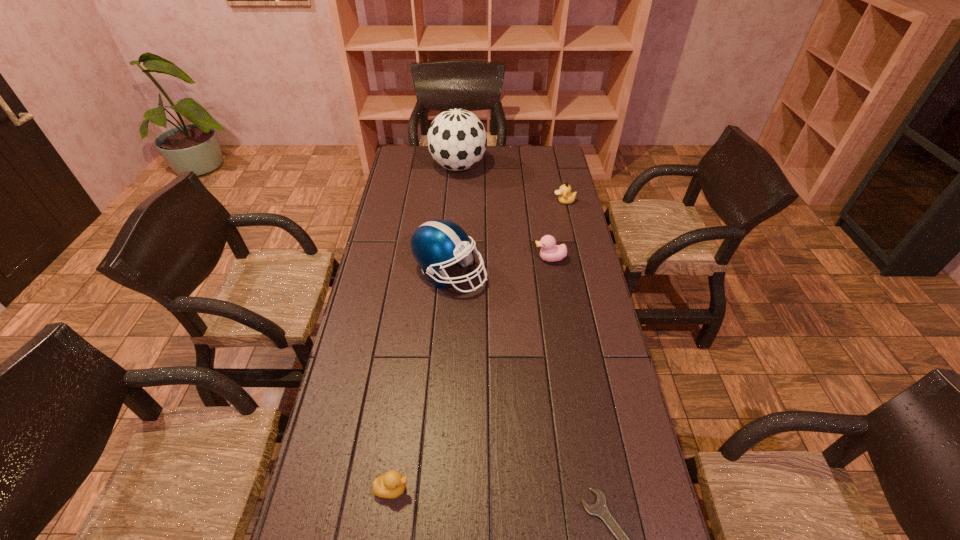
Locate an element on the screen. the third closest duckling to the football helmet is located at coordinates pyautogui.click(x=392, y=484).

Where is `the closest duckling to the wrench`? This screenshot has height=540, width=960. the closest duckling to the wrench is located at coordinates (392, 484).